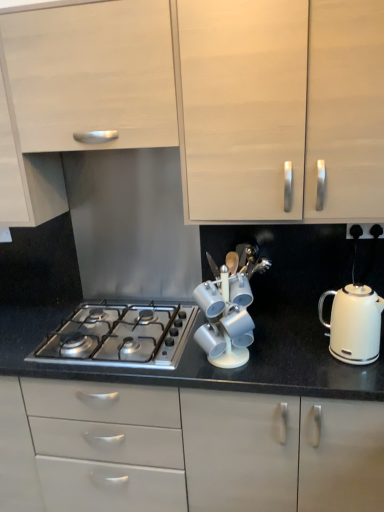
Identify the location of free location to the right of white glossy cup at center. Image resolution: width=384 pixels, height=512 pixels. (279, 356).